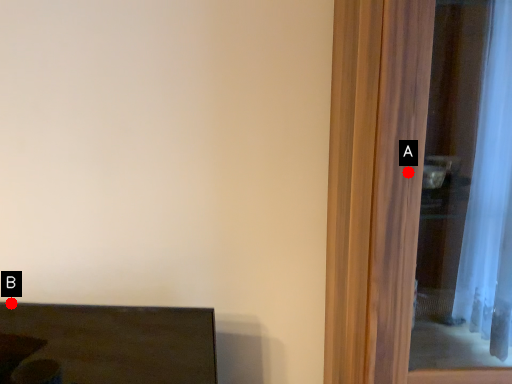
Question: Two points are circled on the image, labeled by A and B beside each circle. Which point is further to the camera?

Choices:
 (A) A is further
 (B) B is further

Answer: (B)